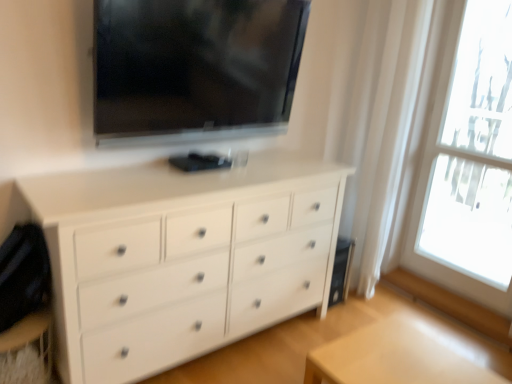
This screenshot has height=384, width=512. In order to click on blank space situated above white matte chest of drawers at center (from a real-world perspective) in this screenshot , I will do `click(147, 173)`.